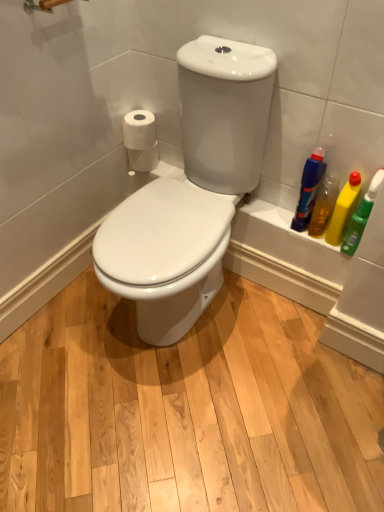
Image resolution: width=384 pixels, height=512 pixels. I want to click on yellow plastic bottle at right, the third cleaning product positioned from the right, so click(324, 204).

This screenshot has height=512, width=384. Describe the element at coordinates (324, 204) in the screenshot. I see `yellow plastic bottle at right, the third cleaning product positioned from the right` at that location.

In order to face green plastic bottle at right, the 1th cleaning product from the right, should I rotate leftwards or rightwards?

A 22.125 degree turn to the right will do.

Describe the element at coordinates (361, 216) in the screenshot. I see `green plastic bottle at right, the 4th cleaning product from the left` at that location.

What is the approximate height of white matte toilet paper at left, which appears as the 2th toilet paper when viewed from the front?

4.30 inches.

Locate an element on the screen. This screenshot has width=384, height=512. yellow plastic bottle at right, the third cleaning product from the left is located at coordinates (344, 209).

Considering the sizes of objects white matte toilet paper at left, which appears as the 2th toilet paper when viewed from the front, and translucent plastic bottle at right, the 1th cleaning product positioned from the left, in the image provided, who is shorter, white matte toilet paper at left, which appears as the 2th toilet paper when viewed from the front, or translucent plastic bottle at right, the 1th cleaning product positioned from the left,?

white matte toilet paper at left, which appears as the 2th toilet paper when viewed from the front, is shorter.

Between white matte toilet paper at left, which appears as the 2th toilet paper when viewed from the front, and translucent plastic bottle at right, which is the 4th cleaning product in right-to-left order, which one appears on the right side from the viewer's perspective?

Positioned to the right is translucent plastic bottle at right, which is the 4th cleaning product in right-to-left order.

From the image's perspective, is white matte toilet paper at left, acting as the 1th toilet paper starting from the back, below translucent plastic bottle at right, which is the 4th cleaning product in right-to-left order?

Incorrect, from the image's perspective, white matte toilet paper at left, acting as the 1th toilet paper starting from the back, is higher than translucent plastic bottle at right, which is the 4th cleaning product in right-to-left order.

Is white matte toilet paper at left, acting as the 1th toilet paper starting from the back, looking in the opposite direction of translucent plastic bottle at right, the 1th cleaning product positioned from the left?

white matte toilet paper at left, acting as the 1th toilet paper starting from the back, is not turned away from translucent plastic bottle at right, the 1th cleaning product positioned from the left.

Looking at this image, from a real-world perspective, is green plastic bottle at right, the 1th cleaning product from the right, on top of yellow plastic bottle at right, marked as the 2th cleaning product in a right-to-left arrangement?

Yes, from a real-world perspective, green plastic bottle at right, the 1th cleaning product from the right, is on top of yellow plastic bottle at right, marked as the 2th cleaning product in a right-to-left arrangement.

Does green plastic bottle at right, the 1th cleaning product from the right, have a larger size compared to yellow plastic bottle at right, the third cleaning product from the left?

Indeed, green plastic bottle at right, the 1th cleaning product from the right, has a larger size compared to yellow plastic bottle at right, the third cleaning product from the left.

Between green plastic bottle at right, the 4th cleaning product from the left, and yellow plastic bottle at right, the third cleaning product from the left, which one has less height?

yellow plastic bottle at right, the third cleaning product from the left.

Between point (364, 210) and point (358, 197), which one is positioned in front?

Point (364, 210)

Does translucent plastic bottle at right, the 1th cleaning product positioned from the left, have a lesser width compared to white glossy toilet seat at center?

Indeed, translucent plastic bottle at right, the 1th cleaning product positioned from the left, has a lesser width compared to white glossy toilet seat at center.

Can we say translucent plastic bottle at right, which is the 4th cleaning product in right-to-left order, lies outside white glossy toilet seat at center?

translucent plastic bottle at right, which is the 4th cleaning product in right-to-left order, is positioned outside white glossy toilet seat at center.

From the image's perspective, is translucent plastic bottle at right, which is the 4th cleaning product in right-to-left order, under white glossy toilet seat at center?

Actually, translucent plastic bottle at right, which is the 4th cleaning product in right-to-left order, appears above white glossy toilet seat at center in the image.

Which object is positioned more to the right, white glossy toilet seat at center or yellow plastic bottle at right, the 2th cleaning product when ordered from left to right?

yellow plastic bottle at right, the 2th cleaning product when ordered from left to right, is more to the right.

Is point (96, 266) farther from viewer compared to point (327, 209)?

No.

Is yellow plastic bottle at right, the third cleaning product positioned from the right, at the back of white glossy toilet seat at center?

That's not correct — white glossy toilet seat at center is not looking away from yellow plastic bottle at right, the third cleaning product positioned from the right.

Would you say white glossy toilet seat at center is a long distance from yellow plastic bottle at right, the third cleaning product positioned from the right?

They are positioned close to each other.

Looking at their sizes, would you say white matte toilet paper at upper left, arranged as the second toilet paper when viewed from the back, is wider or thinner than white matte toilet paper at left, which appears as the 2th toilet paper when viewed from the front?

Clearly, white matte toilet paper at upper left, arranged as the second toilet paper when viewed from the back, has less width compared to white matte toilet paper at left, which appears as the 2th toilet paper when viewed from the front.

Is white matte toilet paper at upper left, placed as the 1th toilet paper when sorted from front to back, turned away from white matte toilet paper at left, acting as the 1th toilet paper starting from the back?

white matte toilet paper at upper left, placed as the 1th toilet paper when sorted from front to back, does not have its back to white matte toilet paper at left, acting as the 1th toilet paper starting from the back.

From the image's perspective, is white matte toilet paper at upper left, arranged as the second toilet paper when viewed from the back, above white matte toilet paper at left, acting as the 1th toilet paper starting from the back?

Yes.

Looking at the image, does white matte toilet paper at upper left, arranged as the second toilet paper when viewed from the back, seem bigger or smaller compared to white matte toilet paper at left, acting as the 1th toilet paper starting from the back?

Considering their sizes, white matte toilet paper at upper left, arranged as the second toilet paper when viewed from the back, takes up more space than white matte toilet paper at left, acting as the 1th toilet paper starting from the back.

Which object is wider, translucent plastic bottle at right, the 1th cleaning product positioned from the left, or yellow plastic bottle at right, marked as the 2th cleaning product in a right-to-left arrangement?

Wider between the two is translucent plastic bottle at right, the 1th cleaning product positioned from the left.

Which is in front, point (310, 164) or point (330, 242)?

Point (310, 164)

The width and height of the screenshot is (384, 512). I want to click on cleaning product that is the 1st object located in front of the translucent plastic bottle at right, the 1th cleaning product positioned from the left, so click(x=344, y=209).

Which object is closer to the camera, translucent plastic bottle at right, the 1th cleaning product positioned from the left, or yellow plastic bottle at right, marked as the 2th cleaning product in a right-to-left arrangement?

Positioned in front is yellow plastic bottle at right, marked as the 2th cleaning product in a right-to-left arrangement.

Could you tell me if yellow plastic bottle at right, the third cleaning product from the left, is turned towards green plastic bottle at right, the 1th cleaning product from the right?

No, yellow plastic bottle at right, the third cleaning product from the left, does not turn towards green plastic bottle at right, the 1th cleaning product from the right.

From the picture: From a real-world perspective, between yellow plastic bottle at right, marked as the 2th cleaning product in a right-to-left arrangement, and green plastic bottle at right, the 1th cleaning product from the right, who is vertically lower?

yellow plastic bottle at right, marked as the 2th cleaning product in a right-to-left arrangement.

Which is closer to the camera, (328, 238) or (369, 188)?

Point (369, 188)

From a real-world perspective, starting from the white matte toilet paper at left, acting as the 1th toilet paper starting from the back, which cleaning product is the 4th one vertically above it? Please provide its 2D coordinates.

[(309, 189)]

Where is `cleaning product located below the yellow plastic bottle at right, the third cleaning product from the left (from the image's perspective)`? The height and width of the screenshot is (512, 384). cleaning product located below the yellow plastic bottle at right, the third cleaning product from the left (from the image's perspective) is located at coordinates point(361,216).

Estimate the real-world distances between objects in this image. Which object is further from yellow plastic bottle at right, marked as the 2th cleaning product in a right-to-left arrangement, white glossy toilet seat at center or yellow plastic bottle at right, the third cleaning product positioned from the right?

The object further to yellow plastic bottle at right, marked as the 2th cleaning product in a right-to-left arrangement, is white glossy toilet seat at center.

Which object lies nearer to the anchor point translucent plastic bottle at right, which is the 4th cleaning product in right-to-left order, white matte toilet paper at upper left, arranged as the second toilet paper when viewed from the back, or yellow plastic bottle at right, the third cleaning product from the left?

The object closer to translucent plastic bottle at right, which is the 4th cleaning product in right-to-left order, is yellow plastic bottle at right, the third cleaning product from the left.

Considering their positions, is white matte toilet paper at upper left, arranged as the second toilet paper when viewed from the back, positioned further to yellow plastic bottle at right, the third cleaning product positioned from the right, than white glossy toilet seat at center?

The object further to yellow plastic bottle at right, the third cleaning product positioned from the right, is white matte toilet paper at upper left, arranged as the second toilet paper when viewed from the back.

Based on their spatial positions, is green plastic bottle at right, the 4th cleaning product from the left, or translucent plastic bottle at right, the 1th cleaning product positioned from the left, closer to white matte toilet paper at upper left, placed as the 1th toilet paper when sorted from front to back?

translucent plastic bottle at right, the 1th cleaning product positioned from the left, lies closer to white matte toilet paper at upper left, placed as the 1th toilet paper when sorted from front to back, than the other object.

From the image, which object appears to be nearer to white matte toilet paper at upper left, arranged as the second toilet paper when viewed from the back, white glossy toilet seat at center or yellow plastic bottle at right, marked as the 2th cleaning product in a right-to-left arrangement?

Based on the image, white glossy toilet seat at center appears to be nearer to white matte toilet paper at upper left, arranged as the second toilet paper when viewed from the back.

Estimate the real-world distances between objects in this image. Which object is closer to yellow plastic bottle at right, the third cleaning product from the left, white matte toilet paper at left, acting as the 1th toilet paper starting from the back, or yellow plastic bottle at right, the third cleaning product positioned from the right?

Based on the image, yellow plastic bottle at right, the third cleaning product positioned from the right, appears to be nearer to yellow plastic bottle at right, the third cleaning product from the left.

Which object lies further to the anchor point white matte toilet paper at upper left, arranged as the second toilet paper when viewed from the back, green plastic bottle at right, the 4th cleaning product from the left, or yellow plastic bottle at right, the third cleaning product positioned from the right?

Based on the image, green plastic bottle at right, the 4th cleaning product from the left, appears to be further to white matte toilet paper at upper left, arranged as the second toilet paper when viewed from the back.

Considering their positions, is white matte toilet paper at left, acting as the 1th toilet paper starting from the back, positioned further to translucent plastic bottle at right, the 1th cleaning product positioned from the left, than yellow plastic bottle at right, the third cleaning product from the left?

Among the two, white matte toilet paper at left, acting as the 1th toilet paper starting from the back, is located further to translucent plastic bottle at right, the 1th cleaning product positioned from the left.

You are a GUI agent. You are given a task and a screenshot of the screen. Output one action in this format:
    pyautogui.click(x=<x>, y=<y>)
    Task: Click on the cleaning product between translucent plastic bottle at right, which is the 4th cleaning product in right-to-left order, and yellow plastic bottle at right, the third cleaning product from the left, from left to right
    This screenshot has width=384, height=512.
    Given the screenshot: What is the action you would take?
    pyautogui.click(x=324, y=204)

The height and width of the screenshot is (512, 384). Identify the location of toilet paper between white glossy toilet seat at center and white matte toilet paper at left, which appears as the 2th toilet paper when viewed from the front, along the z-axis. (139, 130).

Find the location of a particular element. This screenshot has height=512, width=384. toilet paper located between white matte toilet paper at upper left, placed as the 1th toilet paper when sorted from front to back, and green plastic bottle at right, the 4th cleaning product from the left, in the left-right direction is located at coordinates (144, 158).

You are a GUI agent. You are given a task and a screenshot of the screen. Output one action in this format:
    pyautogui.click(x=<x>, y=<y>)
    Task: Click on the sit between white matte toilet paper at upper left, arranged as the second toilet paper when viewed from the back, and green plastic bottle at right, the 4th cleaning product from the left, from left to right
    This screenshot has height=512, width=384.
    Given the screenshot: What is the action you would take?
    pyautogui.click(x=192, y=191)